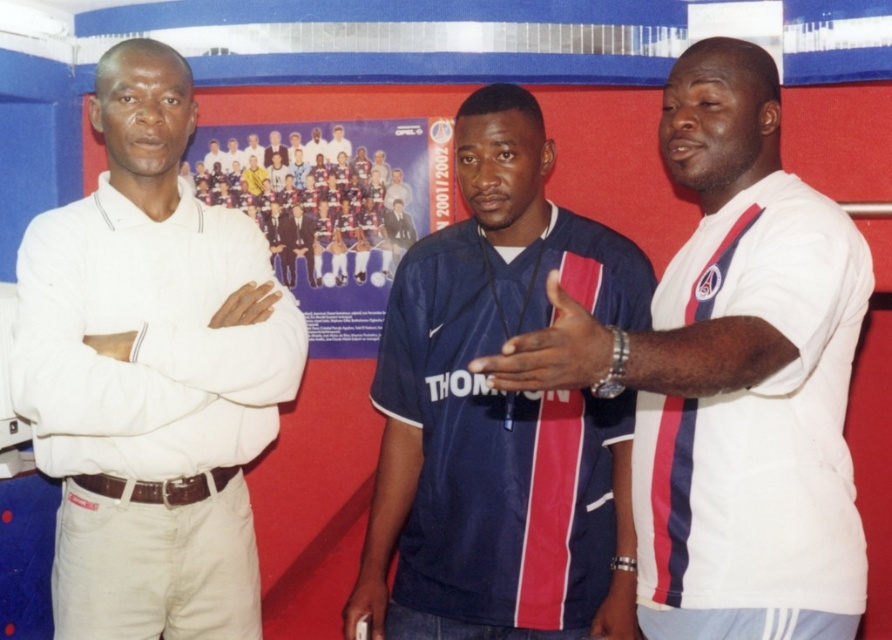
Does white striped shirt at right have a smaller size compared to blue fabric shirt at center?

Actually, white striped shirt at right might be larger than blue fabric shirt at center.

Can you confirm if white striped shirt at right is positioned below blue fabric shirt at center?

Actually, white striped shirt at right is above blue fabric shirt at center.

Is point (716, 618) positioned before point (401, 497)?

Yes, it is.

At what (x,y) coordinates should I click in order to perform the action: click on white striped shirt at right. Please return your answer as a coordinate pair (x, y). The height and width of the screenshot is (640, 892). Looking at the image, I should click on (732, 376).

Looking at this image, between white striped shirt at right and white matte wristband at center, which one appears on the left side from the viewer's perspective?

From the viewer's perspective, white matte wristband at center appears more on the left side.

Who is lower down, white striped shirt at right or white matte wristband at center?

white striped shirt at right is below.

Image resolution: width=892 pixels, height=640 pixels. I want to click on white striped shirt at right, so click(732, 376).

Where is `white striped shirt at right`? The image size is (892, 640). white striped shirt at right is located at coordinates (732, 376).

Is white smooth shirt at left to the right of white matte wristband at center from the viewer's perspective?

No, white smooth shirt at left is not to the right of white matte wristband at center.

Identify the location of white smooth shirt at left. (145, 323).

Which is behind, point (78, 401) or point (588, 364)?

The point (78, 401) is more distant.

The width and height of the screenshot is (892, 640). In order to click on white smooth shirt at left in this screenshot , I will do `click(145, 323)`.